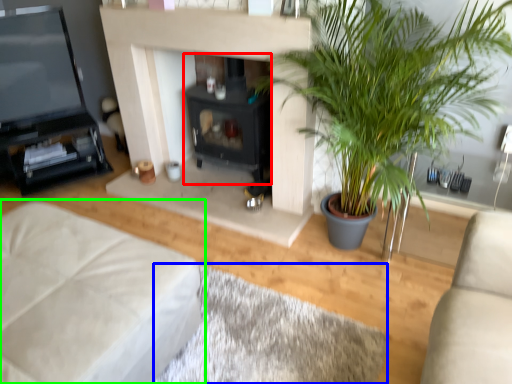
Question: Estimate the real-world distances between objects in this image. Which object is farther from fireplace (highlighted by a red box), plain (highlighted by a blue box) or studio couch (highlighted by a green box)?

Choices:
 (A) plain
 (B) studio couch

Answer: (B)